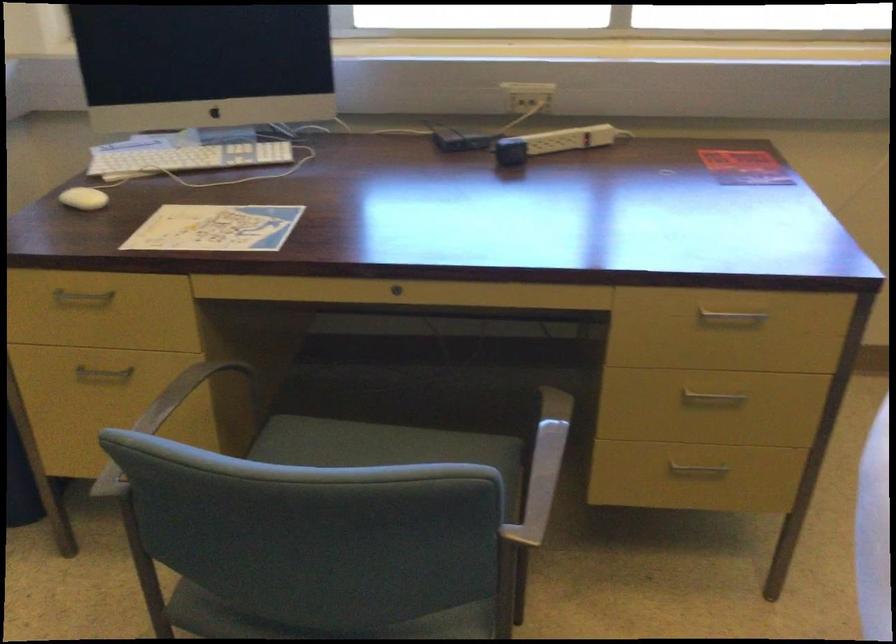
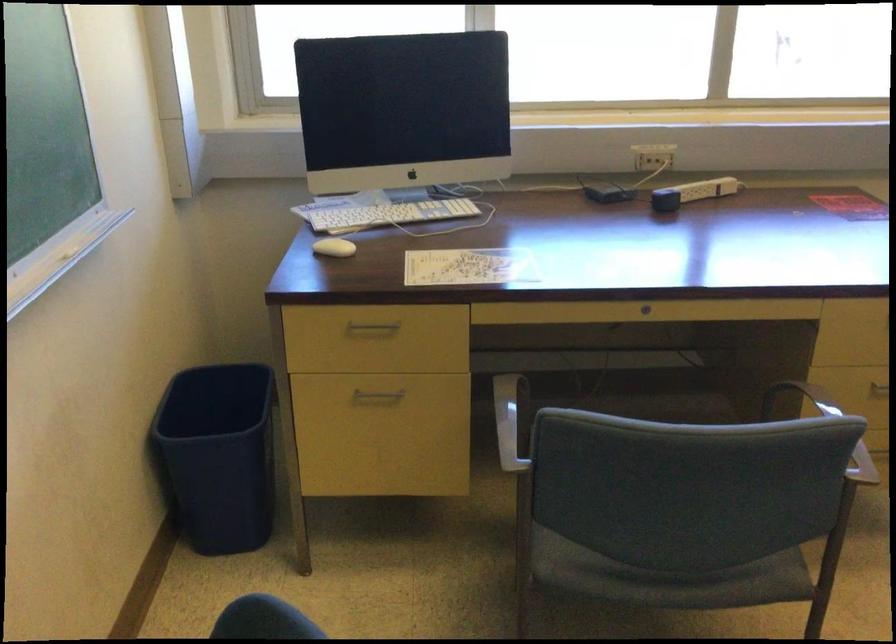
Find the pixel in the second image that matches [87,299] in the first image.

(373, 327)